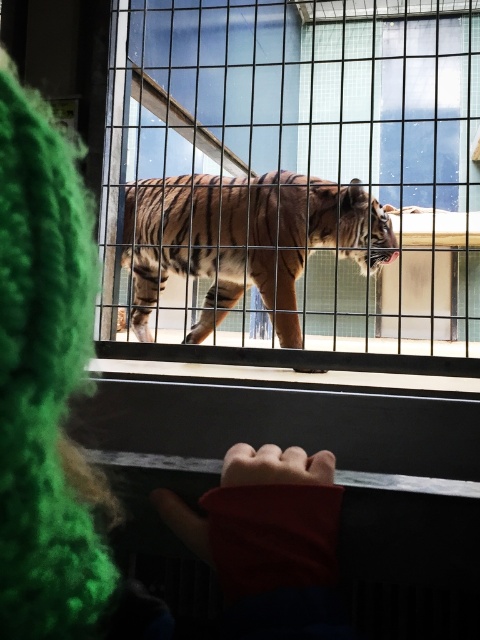
You are a zookeeper preparing to feed the tiger. You have a food tray that must be placed on the clear glass window at center. However, the tiger is currently near the striped fur tiger at center. Considering their sizes, can the food tray be placed on the window without blocking the tiger?

The clear glass window at center has a larger size compared to striped fur tiger at center. Since the window is bigger, there should be enough space to place the food tray on the window while keeping it visible to the tiger without obstruction.